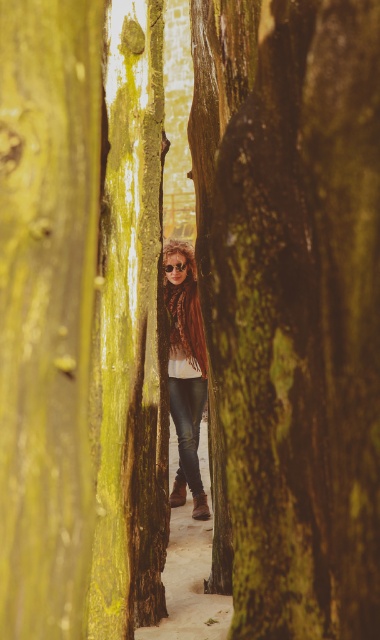
You are a photographer trying to capture the person in the scene. You notice the shiny brown hair at center and the shiny metallic goggles at center. Which object should you focus on if you want to capture the person facing towards the left side of the image?

The shiny metallic goggles at center should be focused on because the shiny brown hair at center is to the right of the shiny metallic goggles at center, indicating the person is facing left.